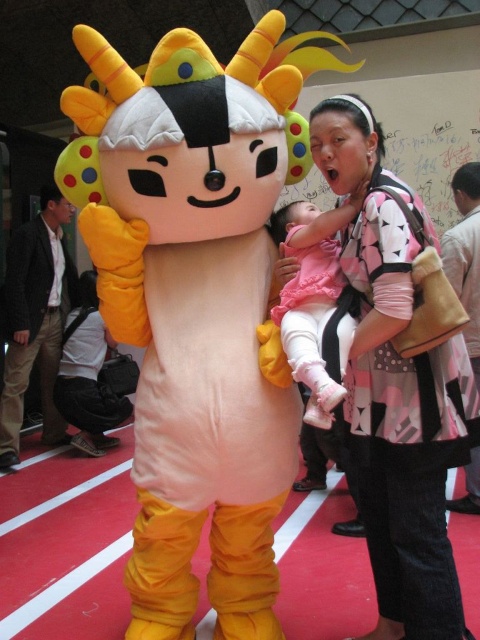
Is matte pink dress at center above matte pink fabric baby at center?

Actually, matte pink dress at center is below matte pink fabric baby at center.

Can you confirm if matte pink dress at center is smaller than matte pink fabric baby at center?

No.

The width and height of the screenshot is (480, 640). Identify the location of matte pink dress at center. (397, 380).

Find the location of a particular element. The image size is (480, 640). matte pink dress at center is located at coordinates (397, 380).